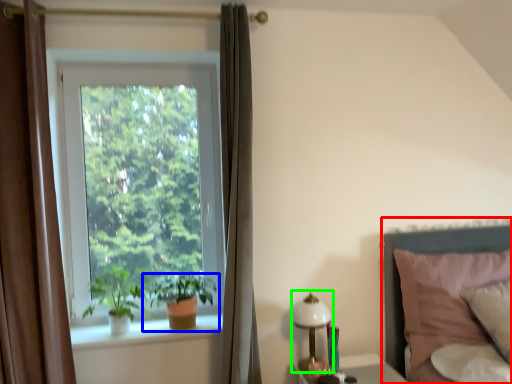
Question: Estimate the real-world distances between objects in this image. Which object is farther from bed (highlighted by a red box), houseplant (highlighted by a blue box) or bedside lamp (highlighted by a green box)?

Choices:
 (A) houseplant
 (B) bedside lamp

Answer: (A)